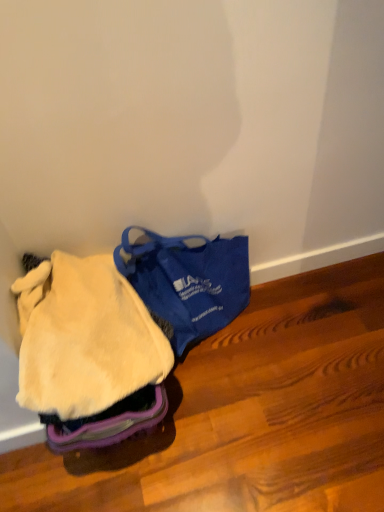
Question: Does fuzzy yellow blanket at lower left have a lesser width compared to blue fabric bag at center?

Choices:
 (A) yes
 (B) no

Answer: (B)

Question: Is blue fabric bag at center completely or partially inside fuzzy yellow blanket at lower left?

Choices:
 (A) yes
 (B) no

Answer: (B)

Question: Is fuzzy yellow blanket at lower left turned away from blue fabric bag at center?

Choices:
 (A) yes
 (B) no

Answer: (B)

Question: Is the depth of fuzzy yellow blanket at lower left less than that of blue fabric bag at center?

Choices:
 (A) no
 (B) yes

Answer: (B)

Question: Does fuzzy yellow blanket at lower left have a larger size compared to blue fabric bag at center?

Choices:
 (A) yes
 (B) no

Answer: (B)

Question: Is fuzzy yellow blanket at lower left outside blue fabric bag at center?

Choices:
 (A) no
 (B) yes

Answer: (B)

Question: Would you say blue fabric bag at center contains fuzzy yellow blanket at lower left?

Choices:
 (A) yes
 (B) no

Answer: (B)

Question: Is blue fabric bag at center to the left of fuzzy yellow blanket at lower left from the viewer's perspective?

Choices:
 (A) yes
 (B) no

Answer: (B)

Question: From the image's perspective, is blue fabric bag at center beneath fuzzy yellow blanket at lower left?

Choices:
 (A) yes
 (B) no

Answer: (B)

Question: Is blue fabric bag at center wider than fuzzy yellow blanket at lower left?

Choices:
 (A) yes
 (B) no

Answer: (B)

Question: Is the position of blue fabric bag at center more distant than that of fuzzy yellow blanket at lower left?

Choices:
 (A) yes
 (B) no

Answer: (A)

Question: Does blue fabric bag at center have a lesser width compared to fuzzy yellow blanket at lower left?

Choices:
 (A) yes
 (B) no

Answer: (A)

Question: Is blue fabric bag at center wider or thinner than fuzzy yellow blanket at lower left?

Choices:
 (A) thin
 (B) wide

Answer: (A)